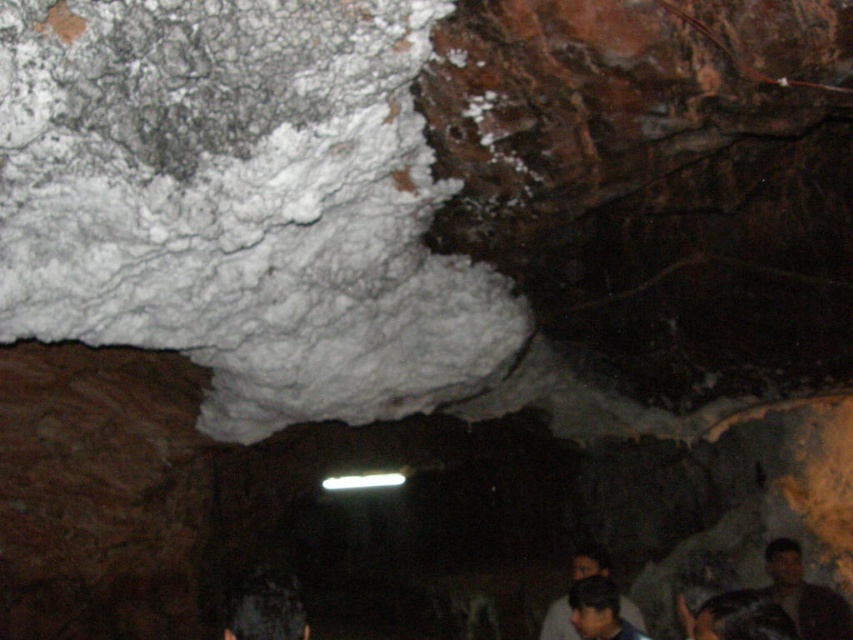
Question: Is white crumbly rock at upper left positioned behind dark brown hair at lower center?

Choices:
 (A) yes
 (B) no

Answer: (B)

Question: Does dark brown hair at lower center have a smaller size compared to dark hair at lower right?

Choices:
 (A) no
 (B) yes

Answer: (B)

Question: Which point is closer to the camera?

Choices:
 (A) (616, 593)
 (B) (550, 616)
 (C) (776, 576)

Answer: (A)

Question: Considering the real-world distances, which object is closest to the dark hair at lower right?

Choices:
 (A) dark brown hair at lower right
 (B) white crumbly rock at upper left
 (C) dark brown leather jacket at lower right
 (D) dark brown hair at lower center

Answer: (A)

Question: Does dark brown hair at lower right lie behind dark hair at lower right?

Choices:
 (A) no
 (B) yes

Answer: (A)

Question: Which point appears farthest from the camera in this image?

Choices:
 (A) (207, 102)
 (B) (637, 611)

Answer: (B)